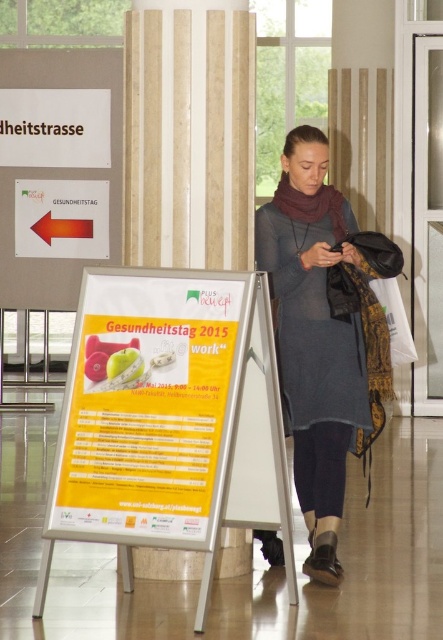
Question: Does yellow paperboard at center appear under orange glossy arrow at left?

Choices:
 (A) yes
 (B) no

Answer: (A)

Question: Observing the image, what is the correct spatial positioning of matte gray dress at center in reference to orange glossy arrow at left?

Choices:
 (A) below
 (B) above

Answer: (A)

Question: Which object appears farthest from the camera in this image?

Choices:
 (A) matte gray dress at center
 (B) orange glossy arrow at left
 (C) yellow paperboard at center

Answer: (B)

Question: Which object appears closest to the camera in this image?

Choices:
 (A) orange glossy arrow at left
 (B) matte gray dress at center

Answer: (B)

Question: Which point is farther to the camera?

Choices:
 (A) yellow paperboard at center
 (B) orange glossy arrow at left

Answer: (B)

Question: Does yellow paperboard at center have a lesser width compared to orange glossy arrow at left?

Choices:
 (A) yes
 (B) no

Answer: (B)